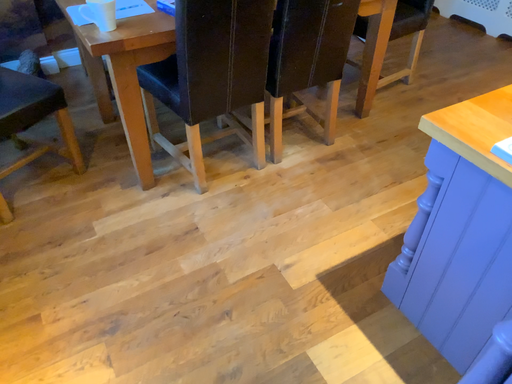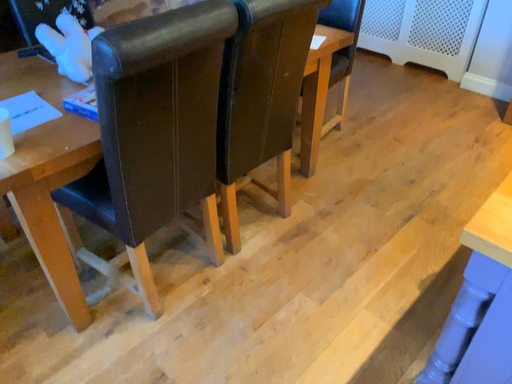
Question: How did the camera likely rotate when shooting the video?

Choices:
 (A) rotated left
 (B) rotated right

Answer: (B)